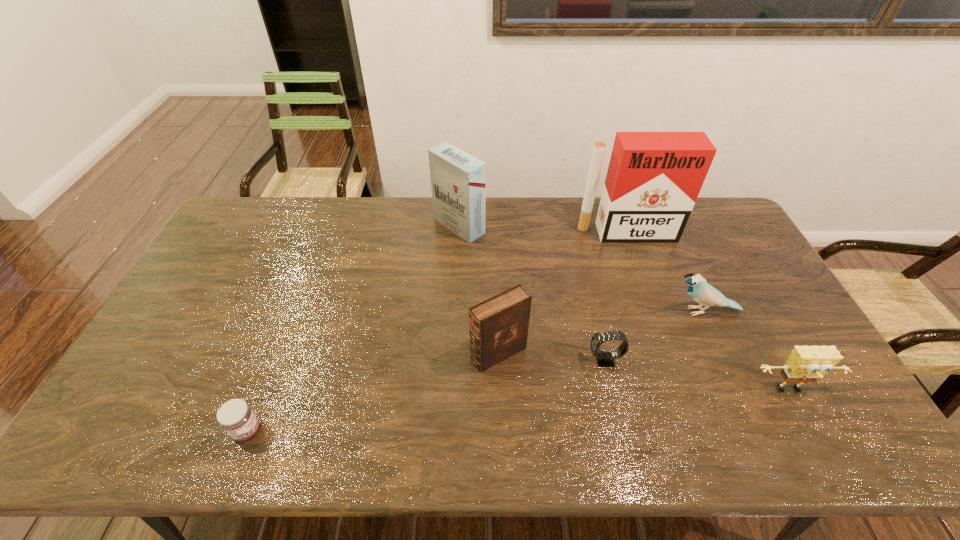
Image resolution: width=960 pixels, height=540 pixels. Find the location of `the right cigarette case`. the right cigarette case is located at coordinates (653, 180).

The height and width of the screenshot is (540, 960). Identify the location of the tallest object. (653, 180).

This screenshot has width=960, height=540. In order to click on the sixth shortest object in this screenshot , I will do `click(458, 180)`.

At what (x,y) coordinates should I click in order to perform the action: click on the shorter cigarette case. Please return your answer as a coordinate pair (x, y). Looking at the image, I should click on (458, 180).

This screenshot has height=540, width=960. What are the coordinates of `the third tallest object` in the screenshot? It's located at (498, 326).

I want to click on bird, so click(x=699, y=290).

Identify the location of sponge. (806, 364).

Locate an element on the screen. watch is located at coordinates (604, 358).

You are a GUI agent. You are given a task and a screenshot of the screen. Output one action in this format:
    pyautogui.click(x=<x>, y=<y>)
    Task: Click on the shortest object
    
    Given the screenshot: What is the action you would take?
    pyautogui.click(x=236, y=417)

Find the location of a particular element. The image size is (960, 540). jam is located at coordinates (236, 417).